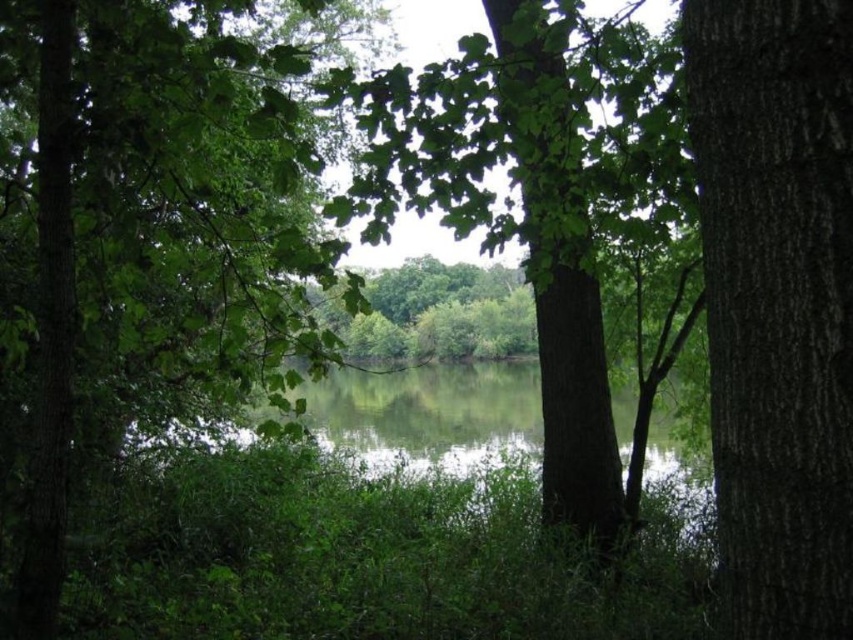
You are standing at the origin point of the coordinate system. You want to walk towards the green leafy tree at center. Which direction should you go?

The green leafy tree at center is located at coordinate point (x=155, y=256). Since the origin is at (x=0, y=0), moving towards positive x and y directions would lead you to the tree.

You are a hiker standing at the edge of the water. You want to take a photo of the smooth bark tree at right without the green leafy tree at center blocking the view. Is it possible to do so from your current position?

The smooth bark tree at right is behind the green leafy tree at center, so it is currently blocked by the green leafy tree at center. To take a photo of the smooth bark tree at right without obstruction, you would need to move to a position where the green leafy tree at center is no longer in front of it.